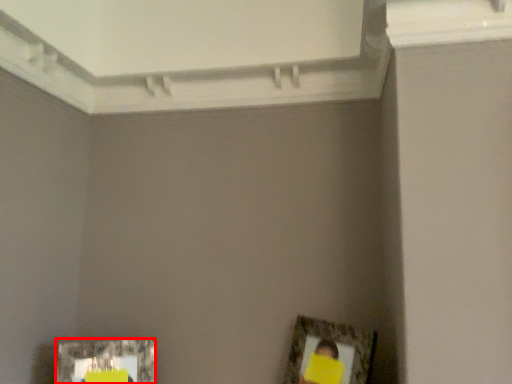
Question: From the image's perspective, where is picture frame (annotated by the red box) located relative to picture frame?

Choices:
 (A) above
 (B) below

Answer: (B)